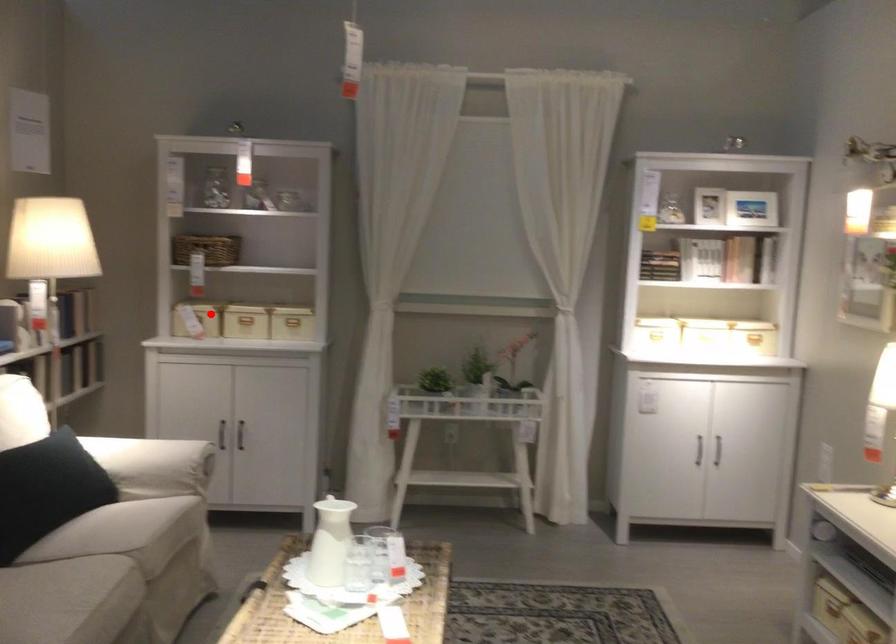
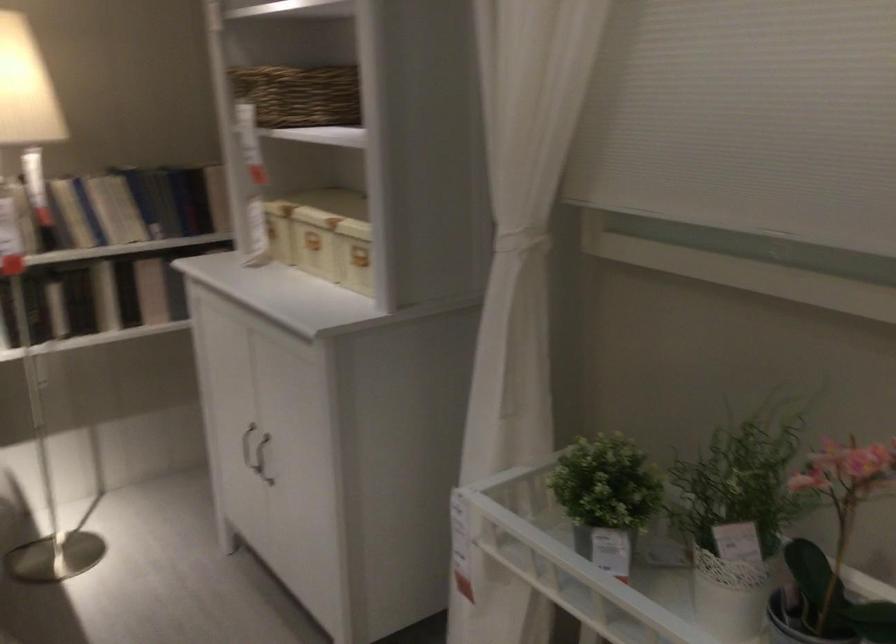
Question: I am providing you with two images of the same scene from different viewpoints. In image1, a red point is highlighted. Considering the same 3D point in image2, which of the following is correct?

Choices:
 (A) It is closer
 (B) It is farther

Answer: (A)